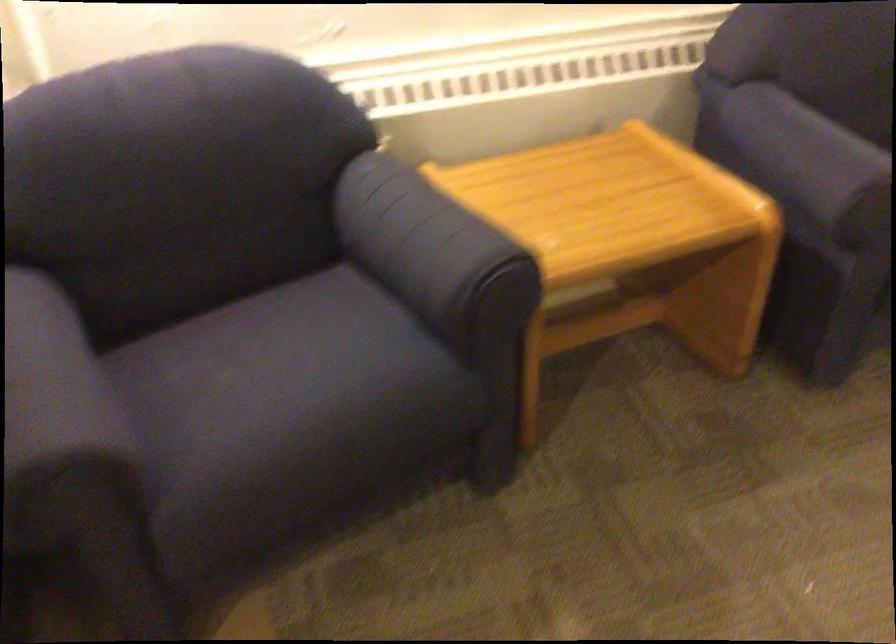
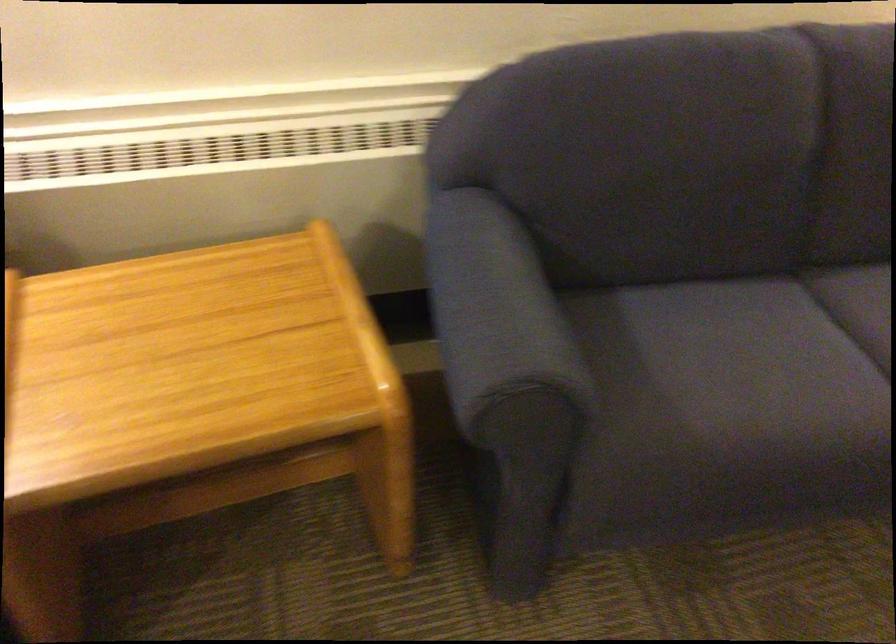
Question: The camera is either moving clockwise (left) or counter-clockwise (right) around the object. The first image is from the beginning of the video and the second image is from the end. Is the camera moving left or right when shooting the video?

Choices:
 (A) Left
 (B) Right

Answer: (B)